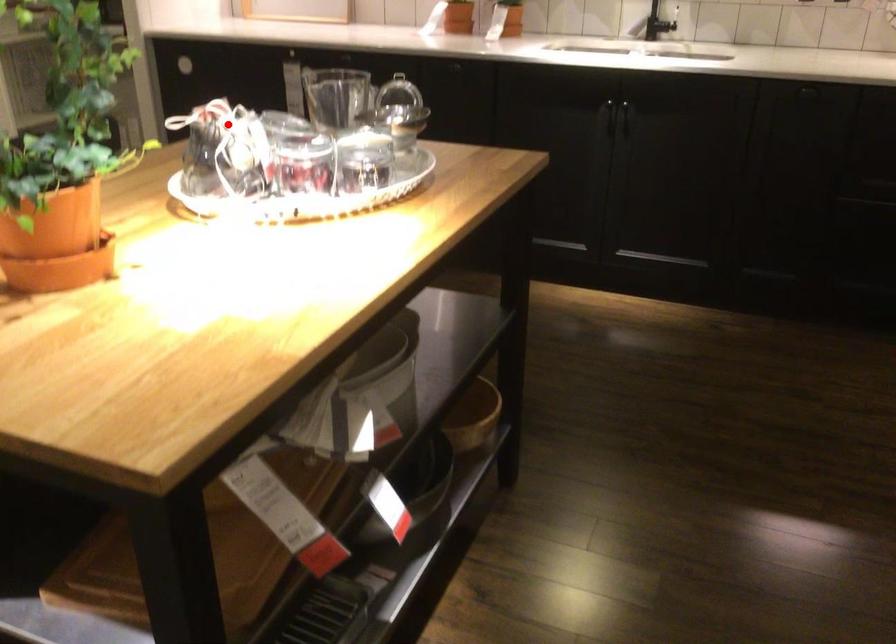
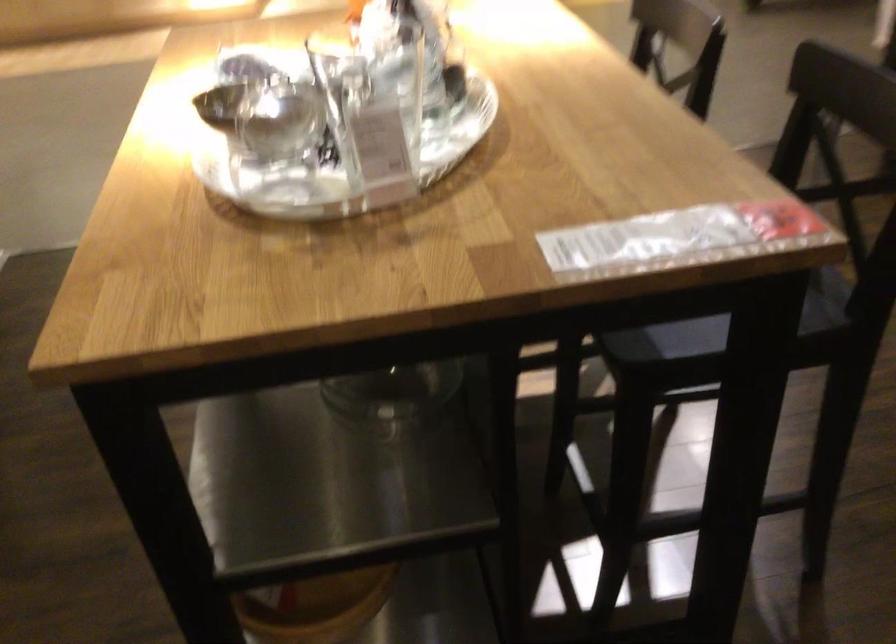
The point at the highlighted location is marked in the first image. Where is the corresponding point in the second image?

(371, 29)